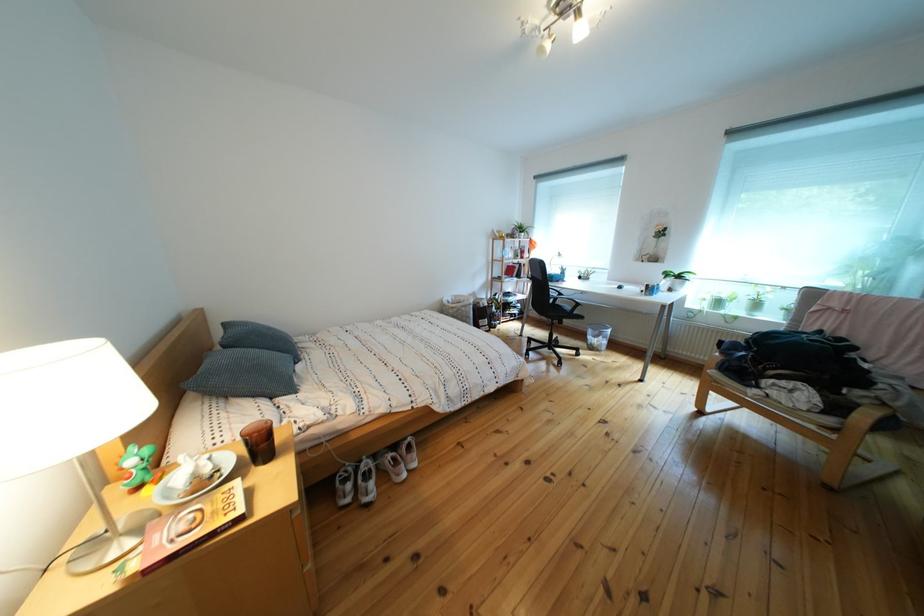
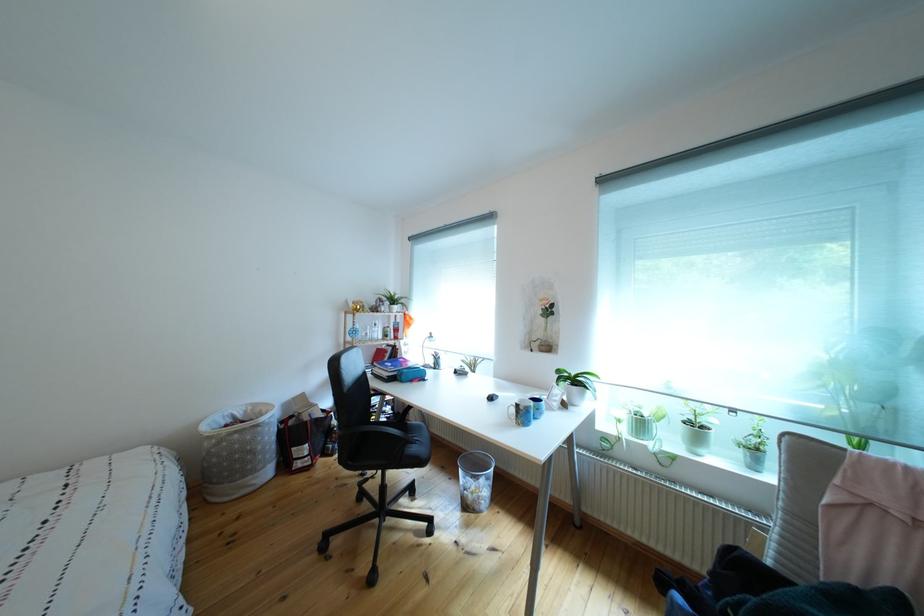
The point at (520, 265) is marked in the first image. Where is the corresponding point in the second image?

(383, 345)